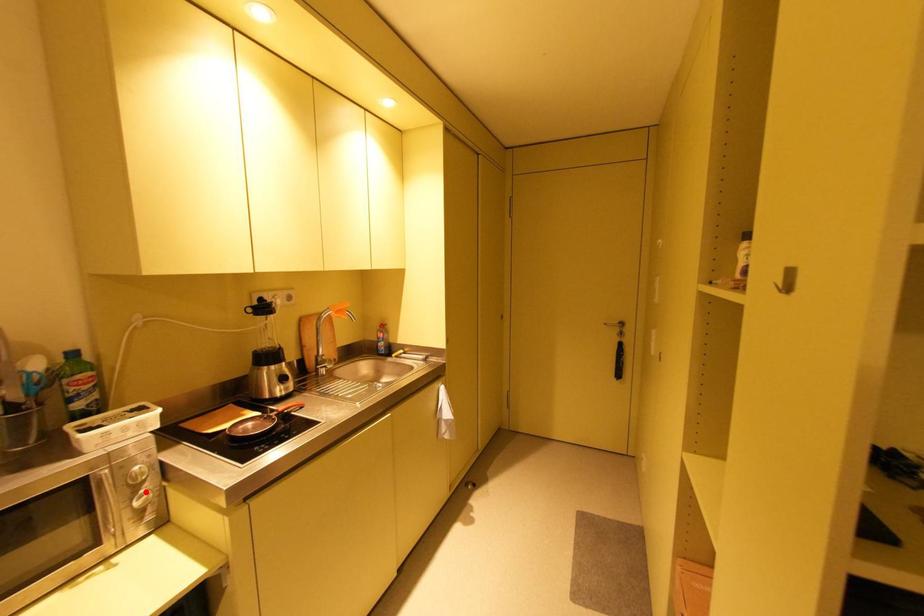
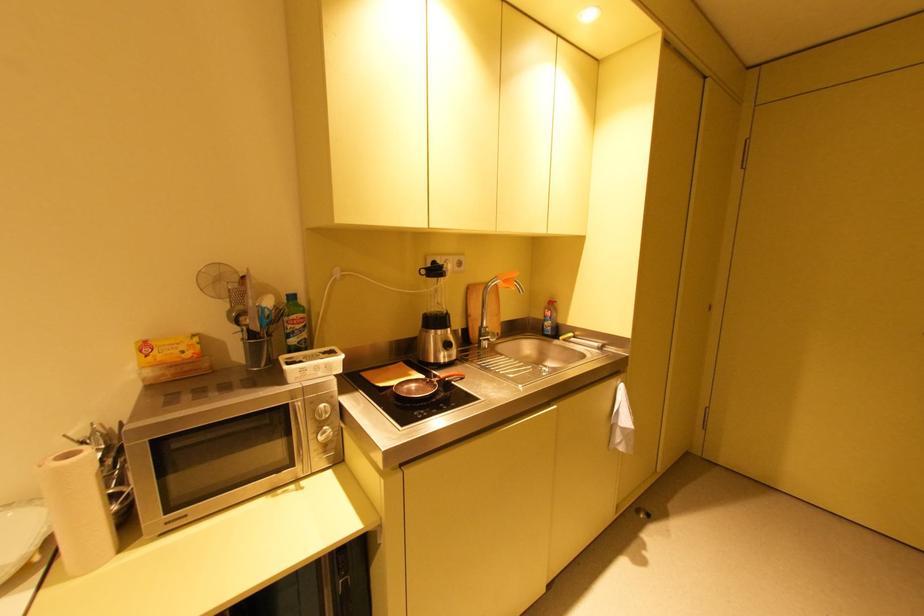
Where in the second image is the point corresponding to the highlighted location from the first image?

(330, 428)